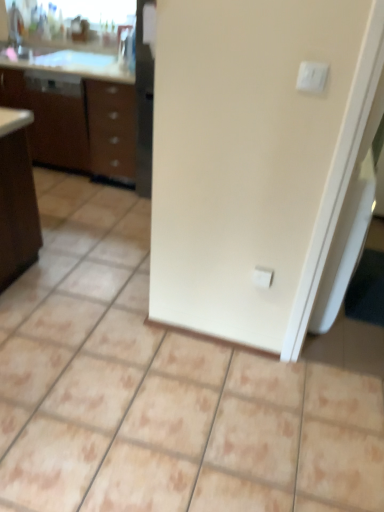
Question: Is white plastic electric outlet at center thinner than white glossy sink at upper left?

Choices:
 (A) no
 (B) yes

Answer: (B)

Question: Considering the relative sizes of white plastic electric outlet at center and white glossy sink at upper left in the image provided, is white plastic electric outlet at center smaller than white glossy sink at upper left?

Choices:
 (A) yes
 (B) no

Answer: (A)

Question: Is white plastic electric outlet at center outside of white glossy sink at upper left?

Choices:
 (A) yes
 (B) no

Answer: (A)

Question: From a real-world perspective, is white plastic electric outlet at center on top of white glossy sink at upper left?

Choices:
 (A) yes
 (B) no

Answer: (B)

Question: Can you confirm if white plastic electric outlet at center is wider than white glossy sink at upper left?

Choices:
 (A) no
 (B) yes

Answer: (A)

Question: From the image's perspective, is white glossy sink at upper left above or below brown wood/file cabinet at left?

Choices:
 (A) above
 (B) below

Answer: (A)

Question: Considering the relative positions of white glossy sink at upper left and brown wood/file cabinet at left in the image provided, is white glossy sink at upper left to the left or to the right of brown wood/file cabinet at left?

Choices:
 (A) left
 (B) right

Answer: (B)

Question: From a real-world perspective, is white glossy sink at upper left physically located above or below brown wood/file cabinet at left?

Choices:
 (A) above
 (B) below

Answer: (A)

Question: From their relative heights in the image, would you say white glossy sink at upper left is taller or shorter than brown wood/file cabinet at left?

Choices:
 (A) short
 (B) tall

Answer: (A)

Question: Is white plastic light switch at upper right inside or outside of white plastic electric outlet at center?

Choices:
 (A) inside
 (B) outside

Answer: (B)

Question: From the image's perspective, is white plastic light switch at upper right above or below white plastic electric outlet at center?

Choices:
 (A) below
 (B) above

Answer: (B)

Question: From a real-world perspective, relative to white plastic electric outlet at center, is white plastic light switch at upper right vertically above or below?

Choices:
 (A) above
 (B) below

Answer: (A)

Question: Is white plastic light switch at upper right bigger or smaller than white plastic electric outlet at center?

Choices:
 (A) small
 (B) big

Answer: (A)

Question: Relative to white plastic electric outlet at center, is white glossy sink at upper left in front or behind?

Choices:
 (A) front
 (B) behind

Answer: (B)

Question: From the image's perspective, is white glossy sink at upper left positioned above or below white plastic electric outlet at center?

Choices:
 (A) below
 (B) above

Answer: (B)